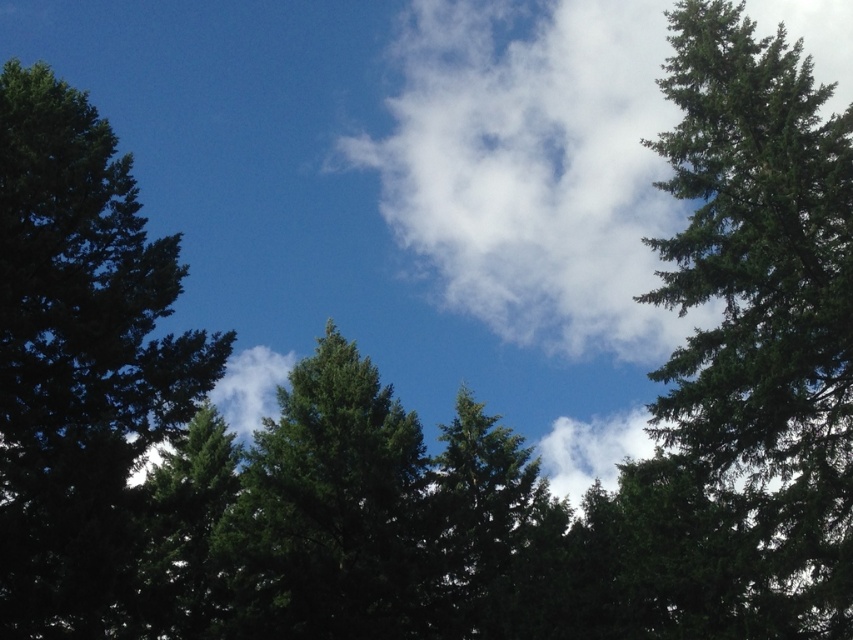
You are an artist painting this scene. You want to ensure the dark green textured tree at left and the green matte tree at center are proportionally accurate. Which tree should you paint smaller?

The dark green textured tree at left should be painted smaller than the green matte tree at center because it has a smaller size compared to the green matte tree at center according to the description.

You are an airplane pilot flying at a high altitude. You notice a white fluffy cloud at center and a green matte tree at center in the distance. Which object is closer to your airplane?

The white fluffy cloud at center is closer to the airplane because it is positioned further to the viewer than the green matte tree at center.